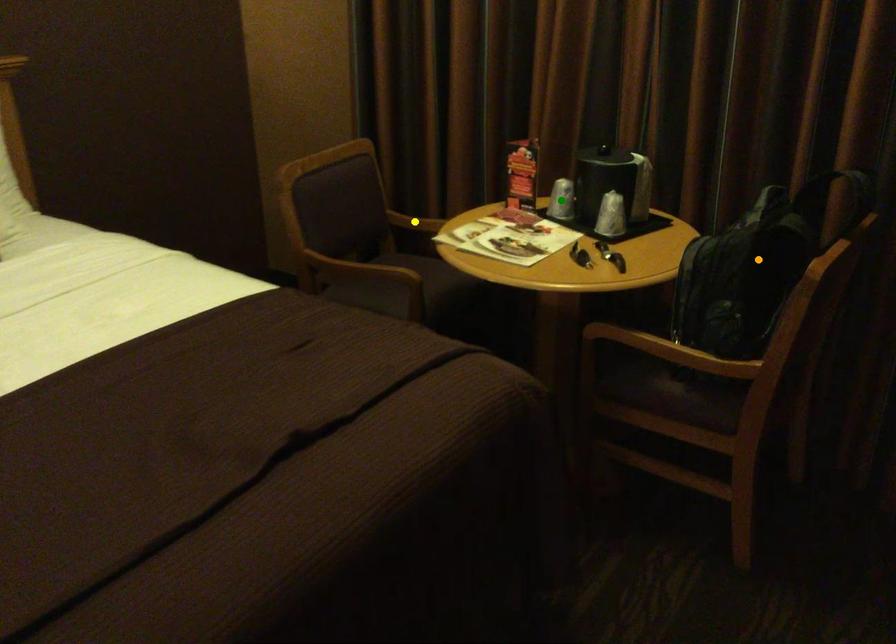
Order these from nearest to farthest:
1. yellow point
2. green point
3. orange point

orange point, green point, yellow point